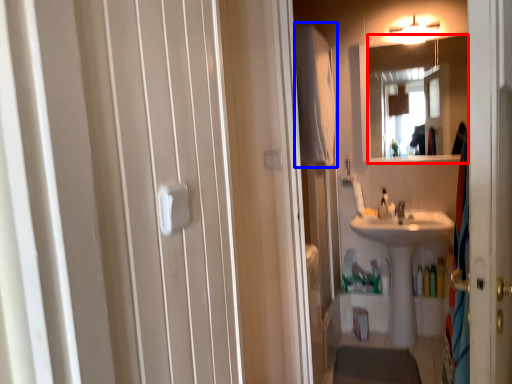
Question: Which of the following is the closest to the observer, mirror (highlighted by a red box) or bath towel (highlighted by a blue box)?

Choices:
 (A) mirror
 (B) bath towel

Answer: (B)